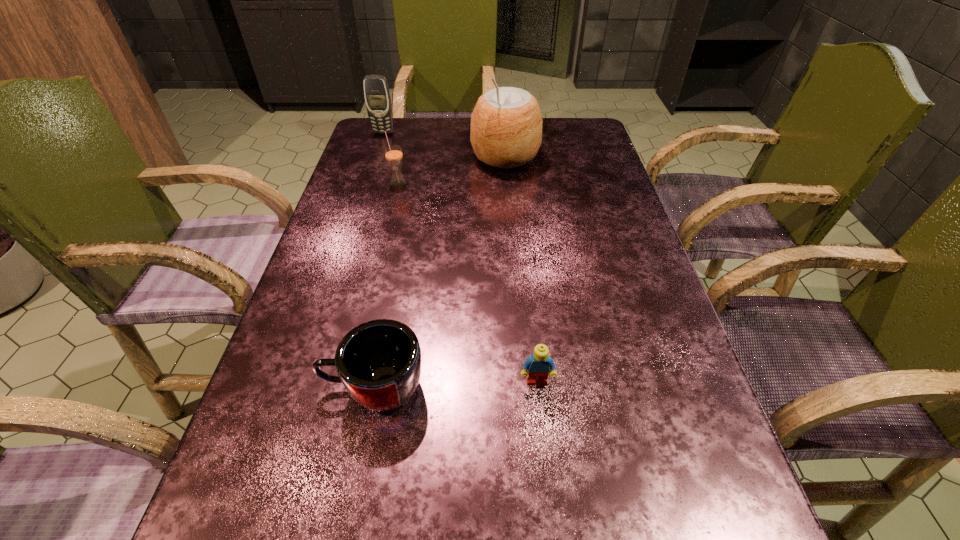
Locate an element on the screen. vacant space situated 0.080m on the right of the third nearest object is located at coordinates (436, 183).

Where is `vacant space located on the face of the Lego`? This screenshot has width=960, height=540. vacant space located on the face of the Lego is located at coordinates (549, 502).

The width and height of the screenshot is (960, 540). In order to click on coconut positioned at the far edge in this screenshot , I will do `click(506, 125)`.

Locate an element on the screen. Image resolution: width=960 pixels, height=540 pixels. cellular telephone that is at the far edge is located at coordinates (377, 97).

At what (x,y) coordinates should I click in order to perform the action: click on cellular telephone at the left edge. Please return your answer as a coordinate pair (x, y). The height and width of the screenshot is (540, 960). Looking at the image, I should click on [x=377, y=97].

Locate an element on the screen. This screenshot has height=540, width=960. straw that is at the left edge is located at coordinates (393, 153).

Where is `mug that is at the left edge`? This screenshot has width=960, height=540. mug that is at the left edge is located at coordinates (379, 362).

Where is `object that is positioned at the far left corner`? The height and width of the screenshot is (540, 960). object that is positioned at the far left corner is located at coordinates (x=377, y=97).

At what (x,y) coordinates should I click in order to perform the action: click on free region at the left edge of the desktop. Please return your answer as a coordinate pair (x, y). The height and width of the screenshot is (540, 960). Looking at the image, I should click on (391, 188).

Locate an element on the screen. The image size is (960, 540). free space at the right edge is located at coordinates (570, 195).